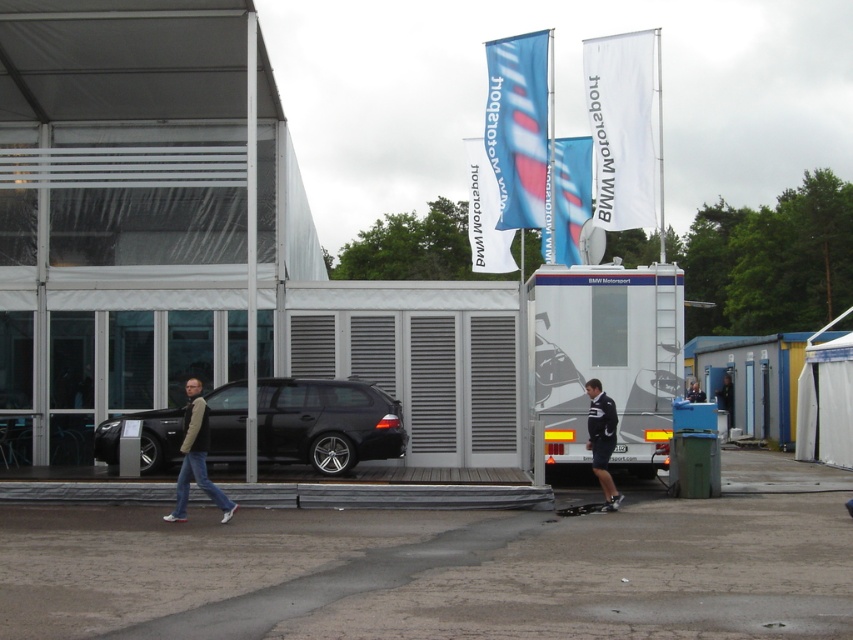
Question: Among these objects, which one is farthest from the camera?

Choices:
 (A) black rubber skateboard at lower center
 (B) shiny black car at center

Answer: (B)

Question: Which point is farther to the camera?

Choices:
 (A) black rubber skateboard at lower center
 (B) dark gray jeans at lower left
 (C) shiny black car at center

Answer: (C)

Question: Does dark gray jeans at lower left appear on the left side of black rubber skateboard at lower center?

Choices:
 (A) yes
 (B) no

Answer: (A)

Question: Can you confirm if dark blue uniform at center is positioned below black rubber skateboard at lower center?

Choices:
 (A) no
 (B) yes

Answer: (A)

Question: Considering the real-world distances, which object is closest to the dark gray jeans at lower left?

Choices:
 (A) black rubber skateboard at lower center
 (B) shiny black car at center
 (C) dark blue uniform at center

Answer: (B)

Question: Does dark gray jeans at lower left appear on the right side of dark blue uniform at center?

Choices:
 (A) yes
 (B) no

Answer: (B)